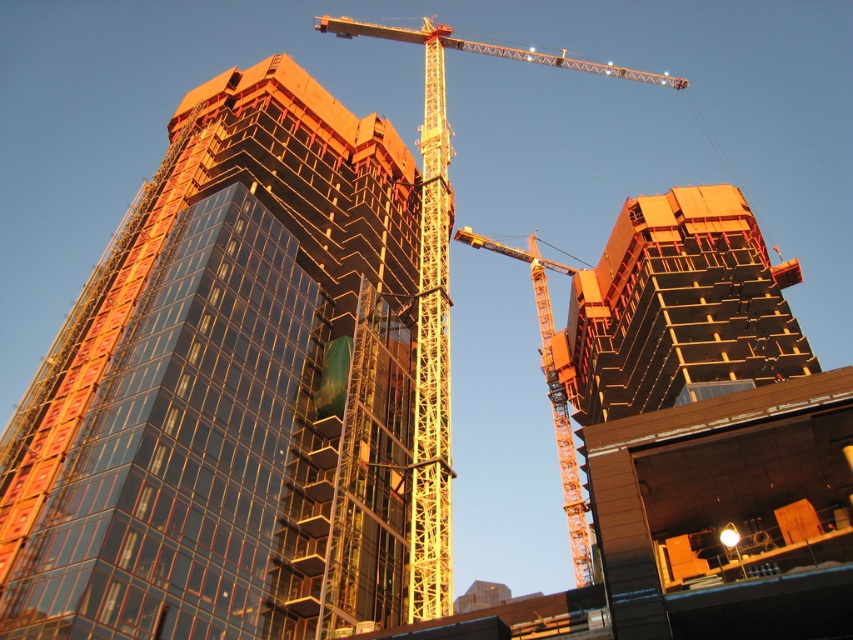
Can you confirm if orange concrete building at right is positioned above yellow metallic crane at center?

Actually, orange concrete building at right is below yellow metallic crane at center.

Does orange concrete building at right have a lesser width compared to yellow metallic crane at center?

Indeed, orange concrete building at right has a lesser width compared to yellow metallic crane at center.

Find the location of a particular element. The height and width of the screenshot is (640, 853). orange concrete building at right is located at coordinates (677, 308).

Is orange concrete building at right wider than orange metallic crane at center?

Indeed, orange concrete building at right has a greater width compared to orange metallic crane at center.

Identify the location of orange concrete building at right. This screenshot has height=640, width=853. (677, 308).

Which is behind, point (206, 570) or point (431, 602)?

The point (206, 570) is more distant.

Can you confirm if glassy reflective building at center is smaller than yellow metallic crane at center?

Yes.

At what (x,y) coordinates should I click in order to perform the action: click on glassy reflective building at center. Please return your answer as a coordinate pair (x, y). The width and height of the screenshot is (853, 640). Looking at the image, I should click on (228, 388).